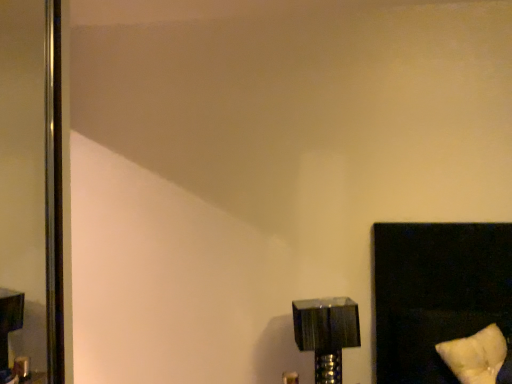
Question: Is the position of metallic silver lamp at lower right less distant than that of white soft pillow at lower right?

Choices:
 (A) yes
 (B) no

Answer: (B)

Question: Is metallic silver lamp at lower right beside white soft pillow at lower right?

Choices:
 (A) yes
 (B) no

Answer: (B)

Question: From the image's perspective, would you say metallic silver lamp at lower right is positioned over white soft pillow at lower right?

Choices:
 (A) no
 (B) yes

Answer: (A)

Question: Does metallic silver lamp at lower right have a greater height compared to white soft pillow at lower right?

Choices:
 (A) yes
 (B) no

Answer: (A)

Question: Is metallic silver lamp at lower right at the right side of white soft pillow at lower right?

Choices:
 (A) no
 (B) yes

Answer: (A)

Question: Is the depth of metallic silver lamp at lower right greater than that of white soft pillow at lower right?

Choices:
 (A) no
 (B) yes

Answer: (B)

Question: Can you confirm if white soft pillow at lower right is wider than metallic silver lamp at lower right?

Choices:
 (A) yes
 (B) no

Answer: (A)

Question: Does white soft pillow at lower right come in front of metallic silver lamp at lower right?

Choices:
 (A) no
 (B) yes

Answer: (B)

Question: Is white soft pillow at lower right located outside metallic silver lamp at lower right?

Choices:
 (A) yes
 (B) no

Answer: (A)

Question: Are white soft pillow at lower right and metallic silver lamp at lower right beside each other?

Choices:
 (A) no
 (B) yes

Answer: (A)

Question: Does white soft pillow at lower right have a smaller size compared to metallic silver lamp at lower right?

Choices:
 (A) no
 (B) yes

Answer: (B)

Question: Considering the relative positions of white soft pillow at lower right and metallic silver lamp at lower right in the image provided, is white soft pillow at lower right behind metallic silver lamp at lower right?

Choices:
 (A) no
 (B) yes

Answer: (A)

Question: Does metallic silver lamp at lower right appear on the left side of polished metallic screen door at left?

Choices:
 (A) no
 (B) yes

Answer: (A)